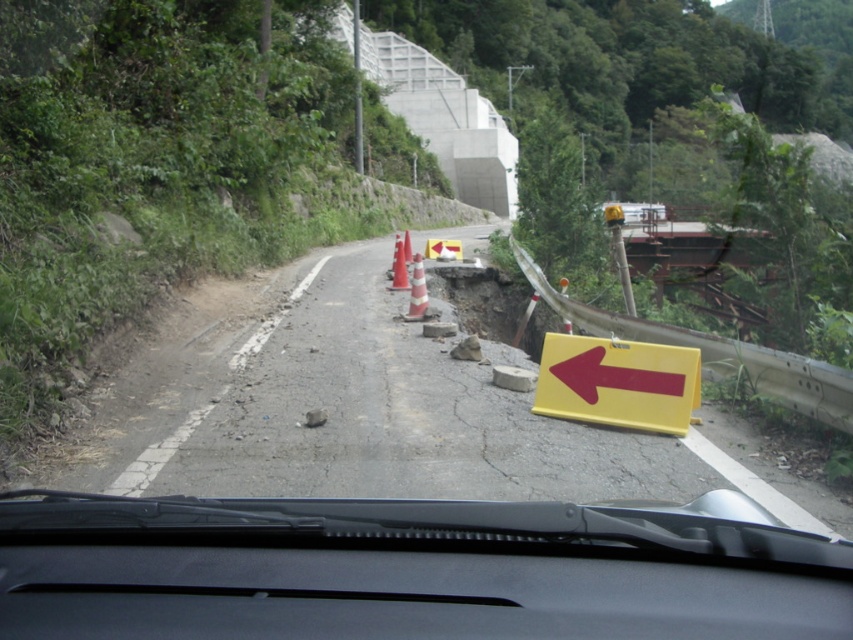
You are driving a car and see the yellow plastic sign at right and the white striped cone at center. Which object is closer to the bottom of the windshield?

The yellow plastic sign at right is located below the white striped cone at center, so it is closer to the bottom of the windshield.